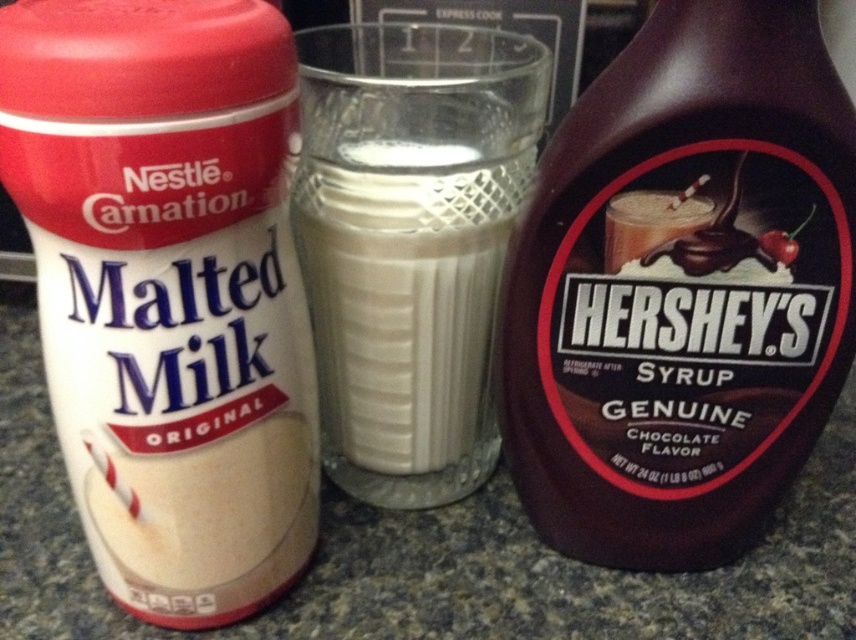
Question: Which point is closer to the camera taking this photo?

Choices:
 (A) (825, 417)
 (B) (321, 356)
 (C) (227, 524)

Answer: (C)

Question: From the image, what is the correct spatial relationship of white matte malted milk powder at left in relation to white opaque glass at center?

Choices:
 (A) above
 (B) below

Answer: (B)

Question: Which object is closer to the camera taking this photo?

Choices:
 (A) white matte malted milk powder at left
 (B) white opaque glass at center

Answer: (A)

Question: Can you confirm if white matte malted milk powder at left is positioned to the right of white opaque glass at center?

Choices:
 (A) yes
 (B) no

Answer: (B)

Question: Does white matte malted milk powder at left lie in front of white opaque glass at center?

Choices:
 (A) yes
 (B) no

Answer: (A)

Question: Estimate the real-world distances between objects in this image. Which object is closer to the dark brown syrup at right?

Choices:
 (A) white matte malted milk powder at left
 (B) white opaque glass at center

Answer: (B)